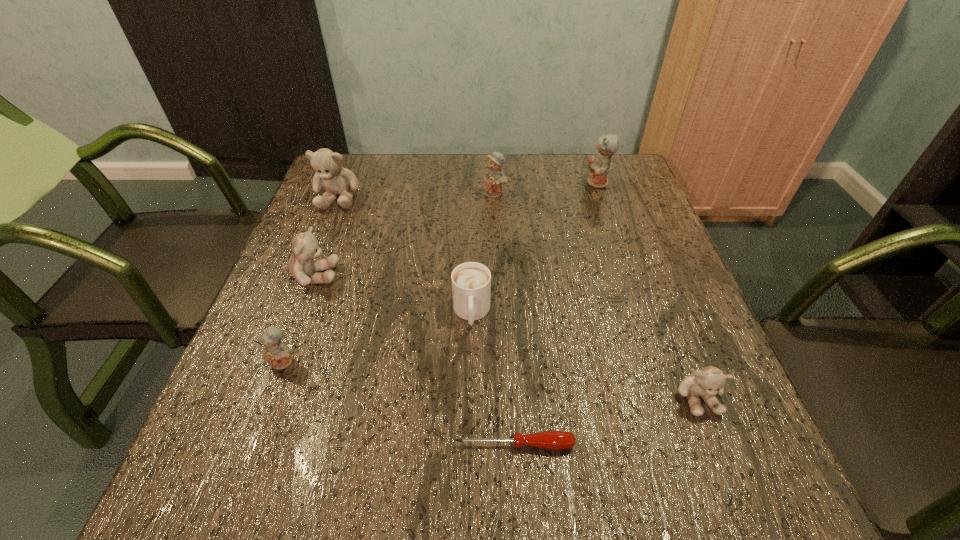
This screenshot has height=540, width=960. I want to click on blank region between the sixth farthest object and the second blue teddy bear from right to left, so coord(390,278).

The image size is (960, 540). Identify the location of vacant space in between the nearest gray teddy bear and the rightmost blue teddy bear. (648, 290).

Where is `free space between the cappuccino and the second biggest gray teddy bear`? The height and width of the screenshot is (540, 960). free space between the cappuccino and the second biggest gray teddy bear is located at coordinates (393, 294).

Locate an element on the screen. empty location between the third nearest object and the red screwdriver is located at coordinates (399, 403).

Identify which object is located as the third nearest to the farthest gray teddy bear. Please provide its 2D coordinates. Your answer should be formatted as a tuple, i.e. [(x, y)], where the tuple contains the x and y coordinates of a point satisfying the conditions above.

[(471, 282)]

Identify which object is the second closest to the nearest teddy bear. Please provide its 2D coordinates. Your answer should be formatted as a tuple, i.e. [(x, y)], where the tuple contains the x and y coordinates of a point satisfying the conditions above.

[(471, 282)]

The width and height of the screenshot is (960, 540). In order to click on teddy bear that is the closest one to the shortest object in this screenshot , I will do `click(707, 382)`.

Identify which teddy bear is located as the nearest to the rightmost gray teddy bear. Please provide its 2D coordinates. Your answer should be formatted as a tuple, i.e. [(x, y)], where the tuple contains the x and y coordinates of a point satisfying the conditions above.

[(599, 165)]

I want to click on blue teddy bear that stands as the second closest to the smallest blue teddy bear, so click(x=599, y=165).

Identify the location of blue teddy bear that can be found as the closest to the second blue teddy bear from left to right. (599, 165).